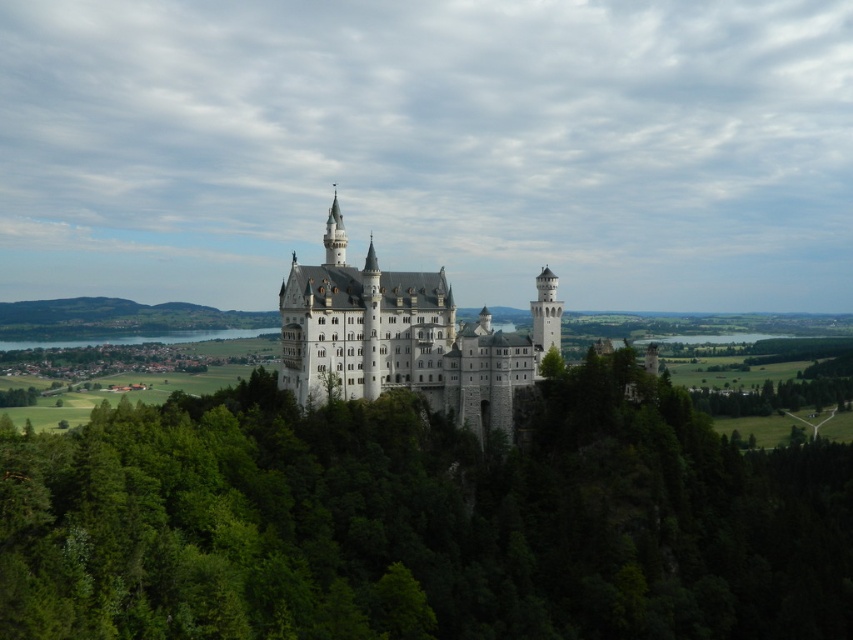
Does green leafy trees at center appear on the left side of white stone castle at center?

Incorrect, green leafy trees at center is not on the left side of white stone castle at center.

Which is in front, point (751, 618) or point (428, 384)?

Point (751, 618) is in front.

Is point (529, 576) less distant than point (465, 403)?

Yes.

The width and height of the screenshot is (853, 640). In order to click on green leafy trees at center in this screenshot , I will do `click(421, 522)`.